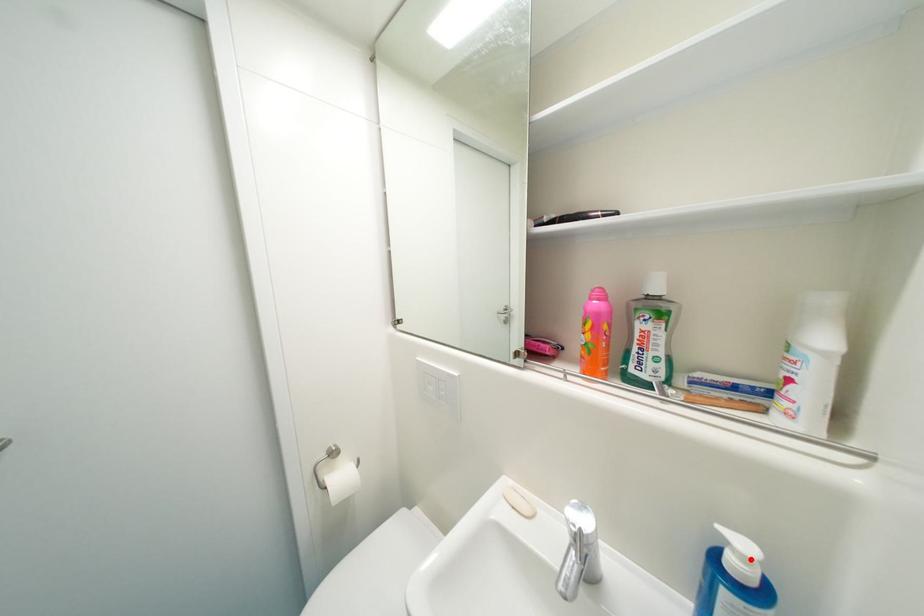
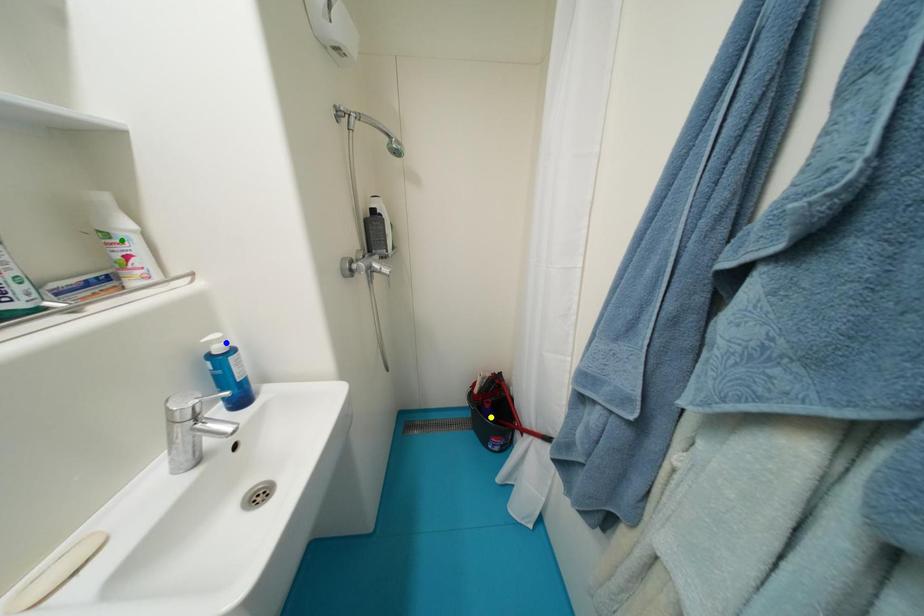
Question: I am providing you with two images of the same scene from different viewpoints. A red point is marked on the first image. You are given multiple points on the second image. Can you choose the point in image 2 that corresponds to the point in image 1?

Choices:
 (A) yellow point
 (B) green point
 (C) blue point

Answer: (C)